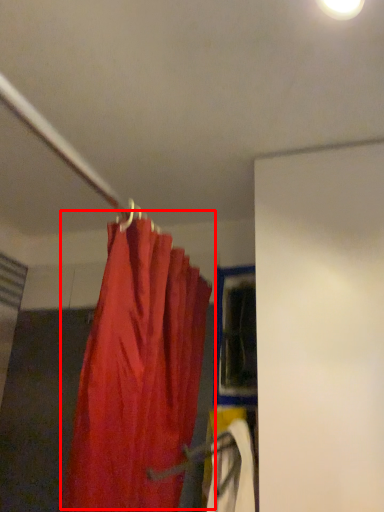
Question: From the image's perspective, where is curtain (annotated by the red box) located relative to window?

Choices:
 (A) below
 (B) above

Answer: (A)